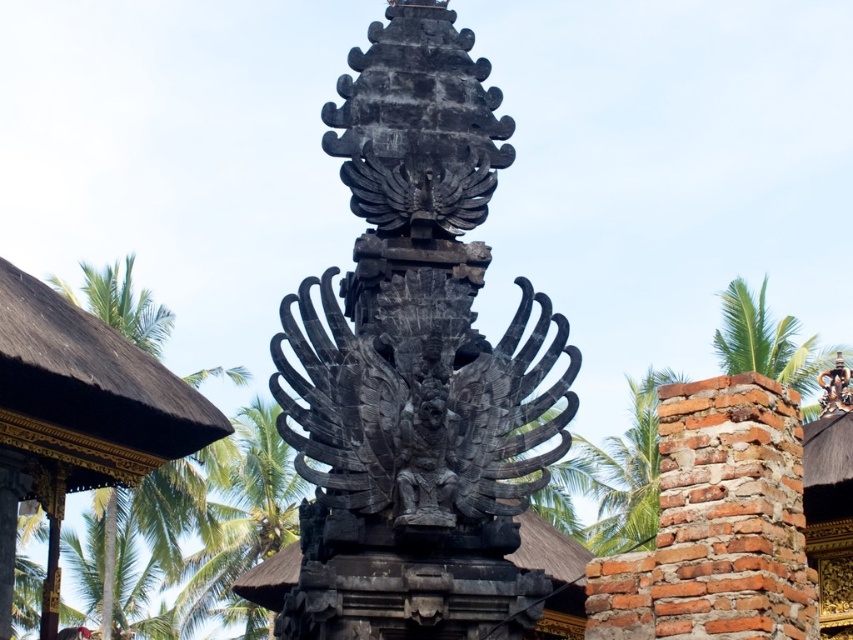
The image size is (853, 640). What do you see at coordinates (416, 364) in the screenshot? I see `black stone statue at center` at bounding box center [416, 364].

Between black stone statue at center and golden textured roof at left, which one appears on the right side from the viewer's perspective?

black stone statue at center

What do you see at coordinates (416, 364) in the screenshot? This screenshot has width=853, height=640. I see `black stone statue at center` at bounding box center [416, 364].

The image size is (853, 640). Find the location of `black stone statue at center`. black stone statue at center is located at coordinates (416, 364).

Does black stone statue at center have a lesser height compared to green leafy palm tree at upper right?

No.

Can you confirm if black stone statue at center is wider than green leafy palm tree at upper right?

No, black stone statue at center is not wider than green leafy palm tree at upper right.

Identify the location of black stone statue at center. (416, 364).

Can you confirm if golden textured roof at left is shorter than green leafy palm tree at right?

Indeed, golden textured roof at left has a lesser height compared to green leafy palm tree at right.

The width and height of the screenshot is (853, 640). What do you see at coordinates (78, 417) in the screenshot?
I see `golden textured roof at left` at bounding box center [78, 417].

Find the location of a particular element. The width and height of the screenshot is (853, 640). golden textured roof at left is located at coordinates (78, 417).